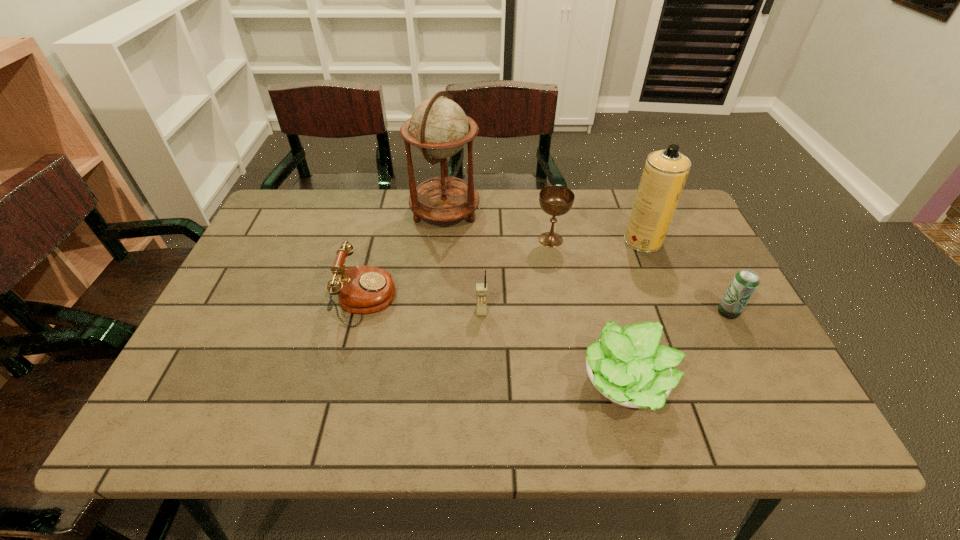
This screenshot has height=540, width=960. In order to click on free space between the tallest object and the sixth object from left to right in this screenshot , I will do `click(544, 226)`.

Locate an element on the screen. The width and height of the screenshot is (960, 540). free point between the chalice and the aerosol can is located at coordinates (597, 240).

The height and width of the screenshot is (540, 960). Find the location of `vacant space that is in between the lettuce and the cellular telephone`. vacant space that is in between the lettuce and the cellular telephone is located at coordinates (554, 349).

You are a GUI agent. You are given a task and a screenshot of the screen. Output one action in this format:
    pyautogui.click(x=<x>, y=<y>)
    Task: Click on the free space between the tallest object and the shortest object
    The height and width of the screenshot is (540, 960).
    Given the screenshot: What is the action you would take?
    pyautogui.click(x=536, y=299)

Where is `free space between the tallest object and the lettuce`? free space between the tallest object and the lettuce is located at coordinates (536, 299).

In order to click on free area in between the second tallest object and the chalice in this screenshot , I will do `click(597, 240)`.

This screenshot has width=960, height=540. I want to click on vacant area that lies between the telephone and the tallest object, so (406, 256).

You are a GUI agent. You are given a task and a screenshot of the screen. Output one action in this format:
    pyautogui.click(x=<x>, y=<y>)
    Task: Click on the free space that is in between the tallest object and the telephone
    The height and width of the screenshot is (540, 960).
    Given the screenshot: What is the action you would take?
    tap(406, 256)

Image resolution: width=960 pixels, height=540 pixels. In order to click on empty space between the sixth shortest object and the telephone in this screenshot , I will do `click(505, 271)`.

The width and height of the screenshot is (960, 540). Find the location of `object that is the fourth closest to the tallest object`. object that is the fourth closest to the tallest object is located at coordinates (665, 172).